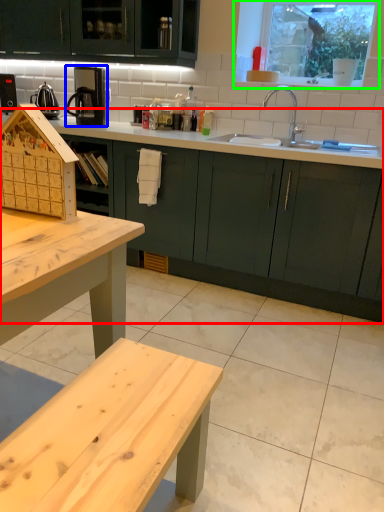
Question: Based on their relative distances, which object is nearer to countertop (highlighted by a red box)? Choose from coffee machine (highlighted by a blue box) and window (highlighted by a green box).

Choices:
 (A) coffee machine
 (B) window

Answer: (A)